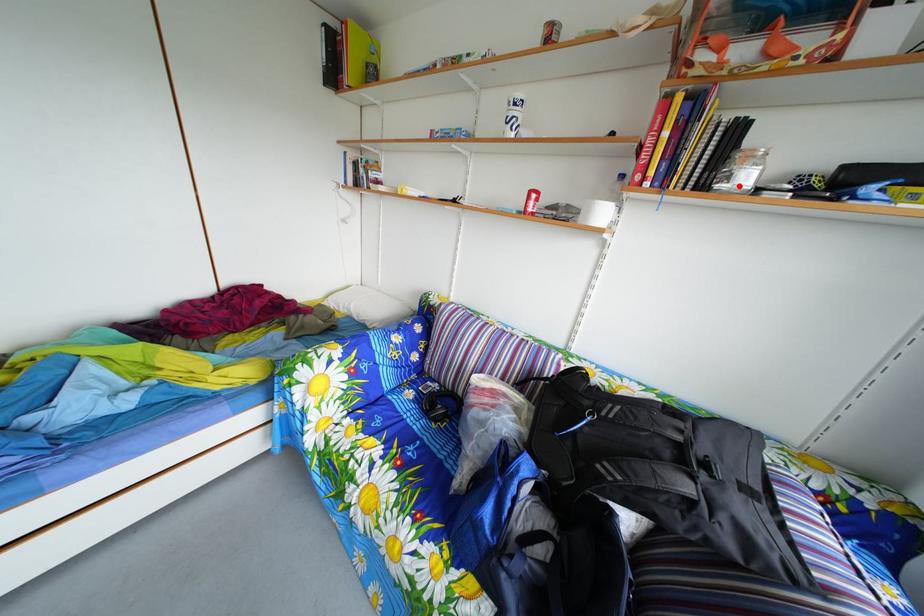
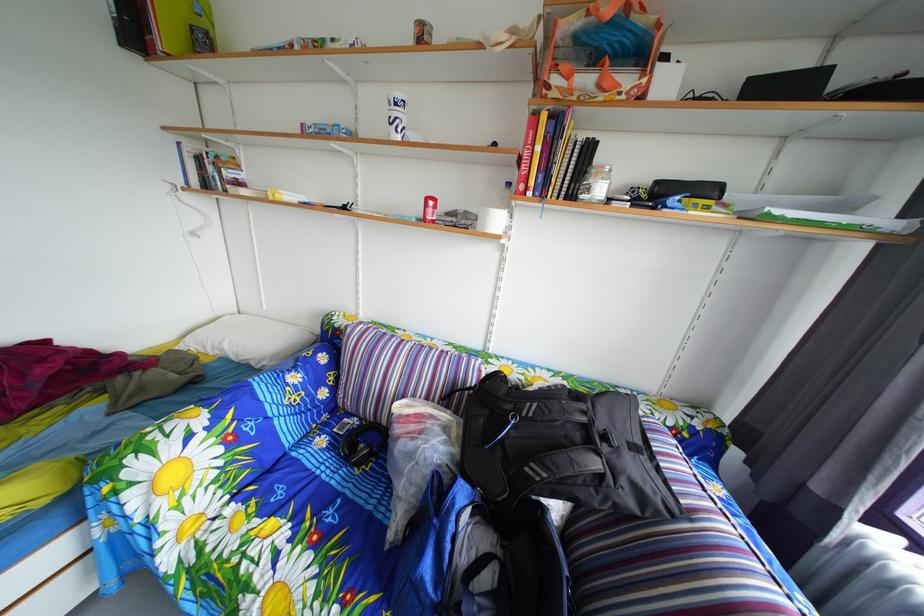
Where in the second image is the point corresponding to the highlighted location from the first image?

(600, 198)